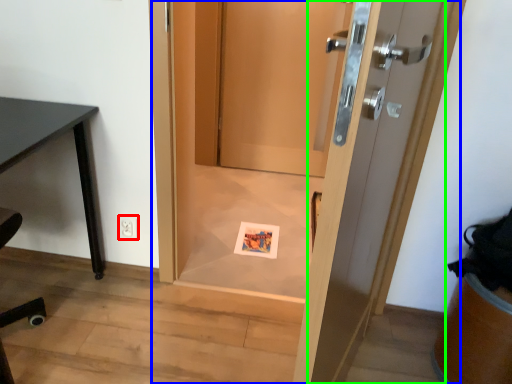
Question: Which object is positioned closest to electric outlet (highlighted by a red box)? Select from door (highlighted by a blue box) and door (highlighted by a green box).

Choices:
 (A) door
 (B) door

Answer: (A)